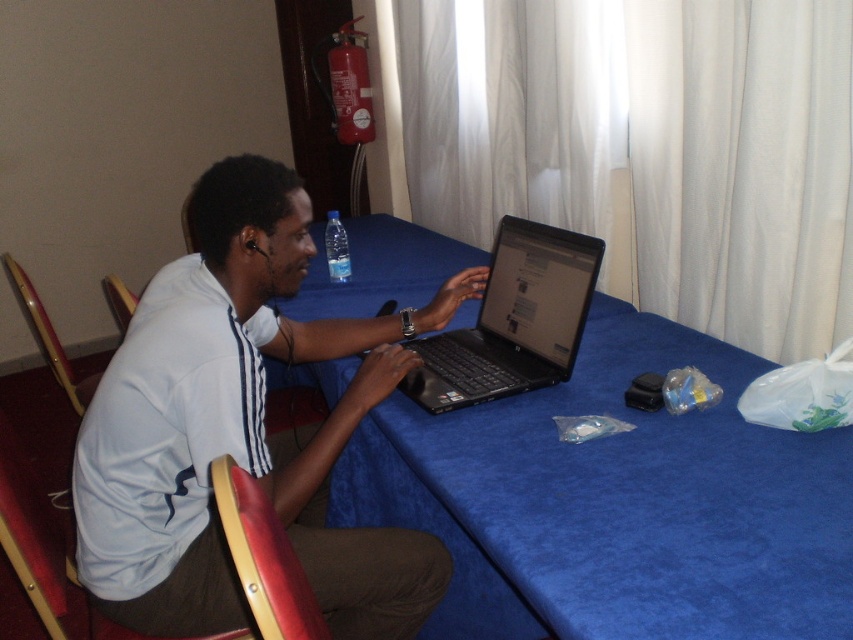
You are standing in front of the table and want to place a small object on the table. You have two options to choose from, either placing it at point (x=602, y=324) or at point (x=347, y=259). Which point is closer to you?

Answer: Point (x=602, y=324) is closer to the viewer than point (x=347, y=259), so placing the object there would be closer to you.

Consider the image. You are a delivery robot that needs to place a package on the table. The package is 1.5 meters long. You see the black plastic laptop at center and the camera on the table. Is there enough space between them to place the package?

The distance between the black plastic laptop at center and the camera is 1.41 meters. Since the package is 1.5 meters long, it won not fit between them.

You are a delivery robot approaching the table. There are two points on the table where you can place a package. The first point is at coordinates point (439, 380) and the second is at point (334, 244). Which point is closer to you as you approach the table?

Point (439, 380) is in front of point (334, 244), so the delivery robot would find point (439, 380) closer as it approaches the table.